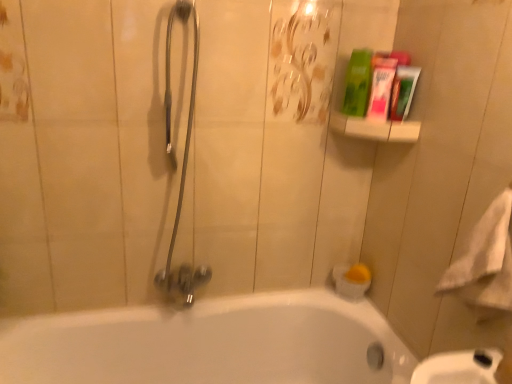
Question: Should I look upward or downward to see satin silver shower head at center left?

Choices:
 (A) up
 (B) down

Answer: (A)

Question: Is white soft towel at right surrounding white glossy bathtub at lower center?

Choices:
 (A) yes
 (B) no

Answer: (B)

Question: Is white soft towel at right positioned beyond the bounds of white glossy bathtub at lower center?

Choices:
 (A) no
 (B) yes

Answer: (B)

Question: Could you tell me if white soft towel at right is facing white glossy bathtub at lower center?

Choices:
 (A) yes
 (B) no

Answer: (B)

Question: From the image's perspective, is white soft towel at right under white glossy bathtub at lower center?

Choices:
 (A) yes
 (B) no

Answer: (B)

Question: Is white soft towel at right positioned with its back to white glossy bathtub at lower center?

Choices:
 (A) yes
 (B) no

Answer: (B)

Question: From a real-world perspective, is white soft towel at right located beneath white glossy bathtub at lower center?

Choices:
 (A) yes
 (B) no

Answer: (B)

Question: Can you confirm if white glossy bathtub at lower center is taller than green matte tube at upper right, marked as the 1th mouthwash in a right-to-left arrangement?

Choices:
 (A) yes
 (B) no

Answer: (A)

Question: From the image's perspective, is white glossy bathtub at lower center located beneath green matte tube at upper right, marked as the 1th mouthwash in a right-to-left arrangement?

Choices:
 (A) no
 (B) yes

Answer: (B)

Question: Is white glossy bathtub at lower center bigger than green matte tube at upper right, which is the 2th mouthwash from left to right?

Choices:
 (A) yes
 (B) no

Answer: (A)

Question: Is white glossy bathtub at lower center closer to camera compared to green matte tube at upper right, marked as the 1th mouthwash in a right-to-left arrangement?

Choices:
 (A) yes
 (B) no

Answer: (A)

Question: Does white glossy bathtub at lower center touch green matte tube at upper right, which is the 2th mouthwash from left to right?

Choices:
 (A) no
 (B) yes

Answer: (A)

Question: Is white glossy bathtub at lower center behind green matte tube at upper right, which is the 2th mouthwash from left to right?

Choices:
 (A) no
 (B) yes

Answer: (A)

Question: Is green matte tube at upper right, marked as the 1th mouthwash in a right-to-left arrangement, wider than white soft towel at right?

Choices:
 (A) no
 (B) yes

Answer: (A)